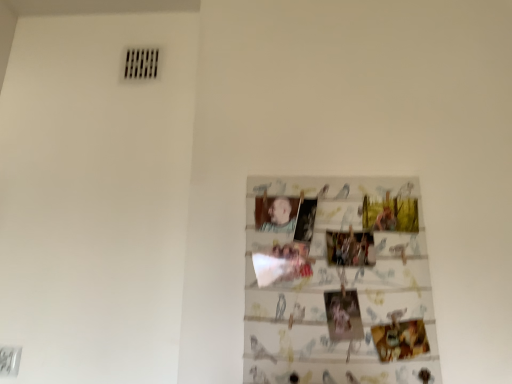
Question: In terms of size, does printed paper collage at center appear bigger or smaller than smooth skin portrait at center?

Choices:
 (A) small
 (B) big

Answer: (B)

Question: Looking at their shapes, would you say printed paper collage at center is wider or thinner than smooth skin portrait at center?

Choices:
 (A) thin
 (B) wide

Answer: (B)

Question: From a real-world perspective, is printed paper collage at center physically located above or below smooth skin portrait at center?

Choices:
 (A) below
 (B) above

Answer: (A)

Question: From a real-world perspective, is smooth skin portrait at center above or below printed paper collage at center?

Choices:
 (A) below
 (B) above

Answer: (B)

Question: In terms of height, does smooth skin portrait at center look taller or shorter compared to printed paper collage at center?

Choices:
 (A) tall
 (B) short

Answer: (B)

Question: Considering their positions, is smooth skin portrait at center located in front of or behind printed paper collage at center?

Choices:
 (A) front
 (B) behind

Answer: (B)

Question: Is point (274, 205) positioned closer to the camera than point (342, 211)?

Choices:
 (A) farther
 (B) closer

Answer: (A)